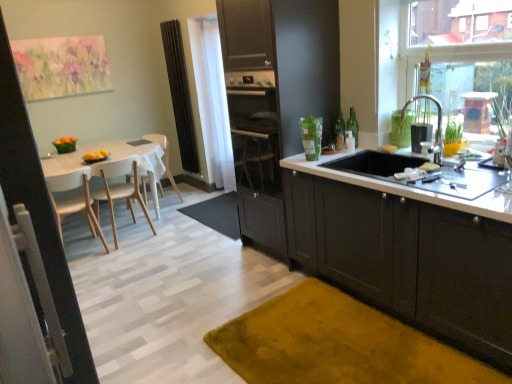
Locate an element on the screen. This screenshot has height=384, width=512. free spot in front of green glass bottle at upper right, placed as the second bottle when sorted from right to left is located at coordinates (349, 149).